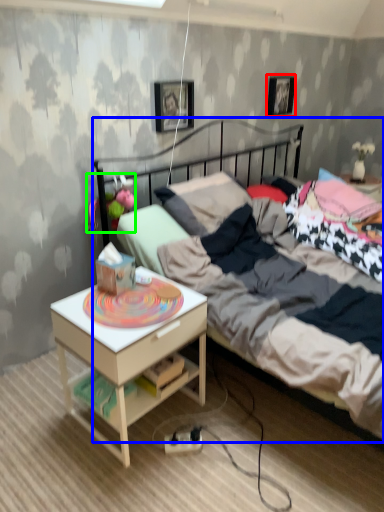
Question: Which is nearer to the picture frame (highlighted by a red box)? bed (highlighted by a blue box) or toy (highlighted by a green box).

Choices:
 (A) bed
 (B) toy

Answer: (A)